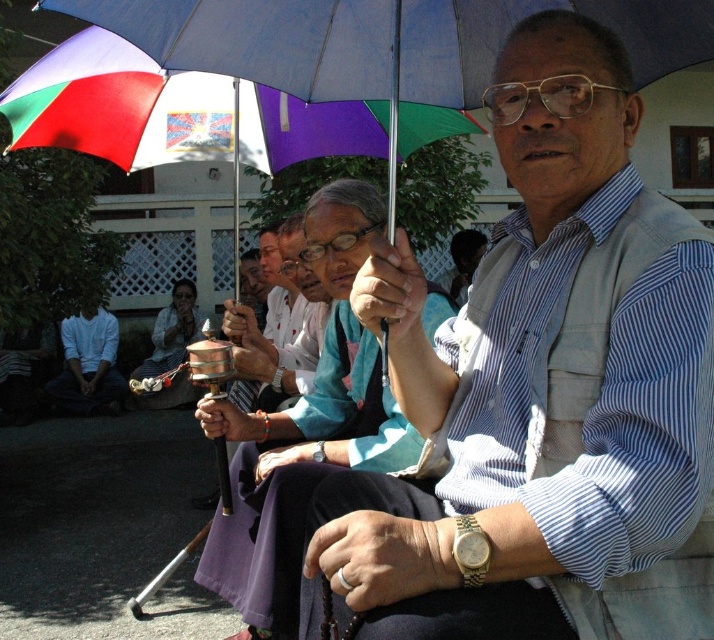
You are a photographer trying to capture a photo of the matte black umbrella at center and the white matte shirt at lower left. Which object is positioned closer to the camera?

The matte black umbrella at center is closer to the viewer than the white matte shirt at lower left, so it will appear closer to the camera.

You are standing at point (443, 128) and want to walk to the prayer wheels being held by some participants. There is an obstacle at point (271, 499). Can you walk directly towards the prayer wheels without going around the obstacle?

Point (271, 499) is in front of point (443, 128), so the obstacle is blocking the path between you and the prayer wheels. You need to go around the obstacle to reach the prayer wheels.